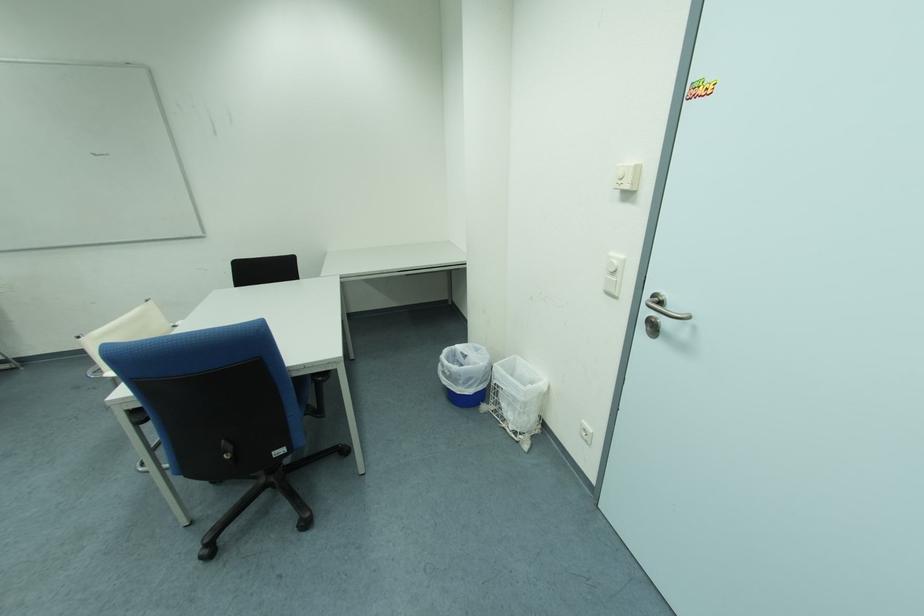
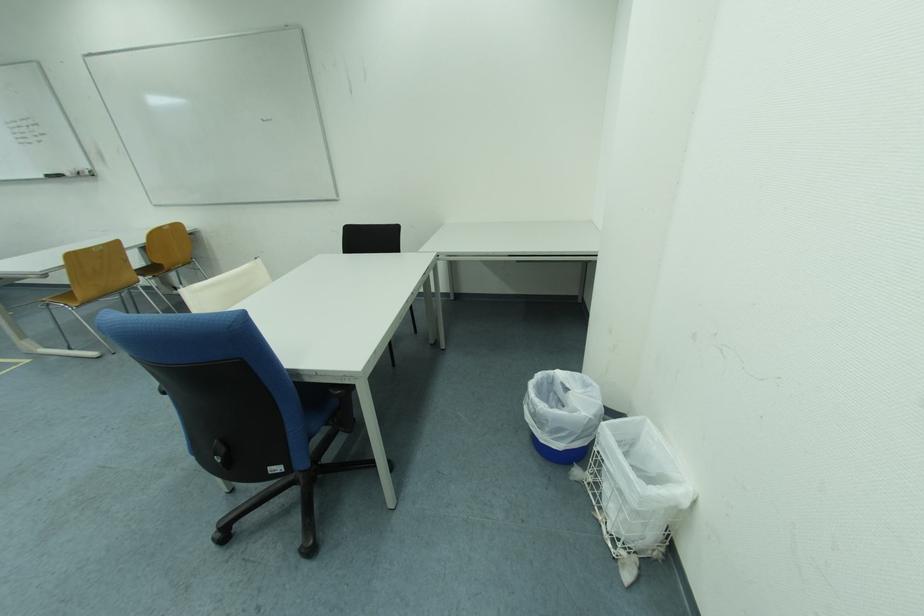
Question: In a continuous first-person perspective shot, in which direction is the camera moving?

Choices:
 (A) Left
 (B) Right
 (C) Forward
 (D) Backward

Answer: (C)